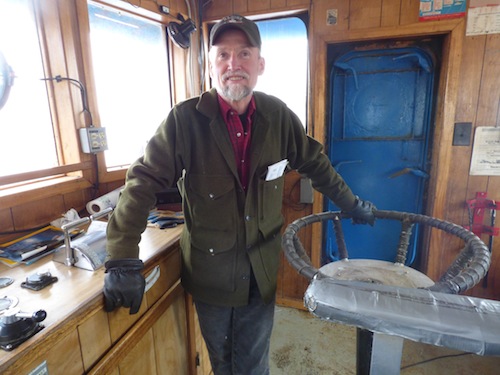
Locate an element on the screen. The image size is (500, 375). countertop is located at coordinates (50, 301).